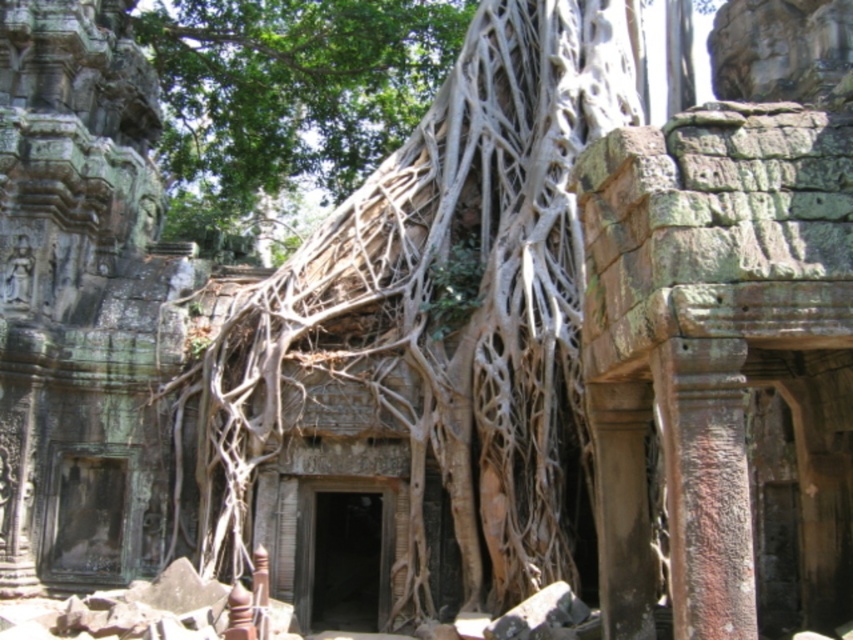
Question: Is brown textured roots at center bigger than gray stone carving at left?

Choices:
 (A) yes
 (B) no

Answer: (A)

Question: Does brown textured roots at center have a greater width compared to gray stone carving at left?

Choices:
 (A) no
 (B) yes

Answer: (B)

Question: Which point is closer to the camera?

Choices:
 (A) brown textured roots at center
 (B) gray stone carving at left

Answer: (A)

Question: Is brown textured roots at center wider than gray stone carving at left?

Choices:
 (A) yes
 (B) no

Answer: (A)